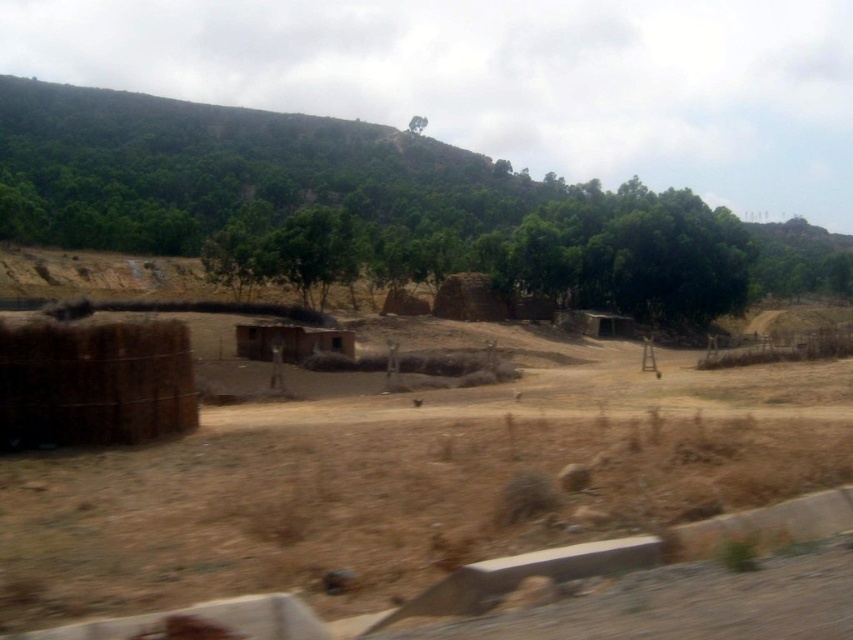
From the picture: You are standing at the edge of the dirt road bordered by the low concrete curb. You see the green leafy tree at upper center and the brown matte train window at center. Which object is higher in the image?

The green leafy tree at upper center is located above the brown matte train window at center, so the green leafy tree at upper center is higher in the image.

Consider the image. You are standing at the edge of the brown dry dirt field at center and want to look up at the green leafy tree at upper center. In which direction should you look?

You should look upward because the brown dry dirt field at center is located below the green leafy tree at upper center.

You are standing on the dirt road and want to walk to the green leafy tree at upper center. Which direction should you go relative to the brown dry dirt field at center?

You should walk to the left of the brown dry dirt field at center because the green leafy tree at upper center is positioned on the left side of the brown dry dirt field at center.